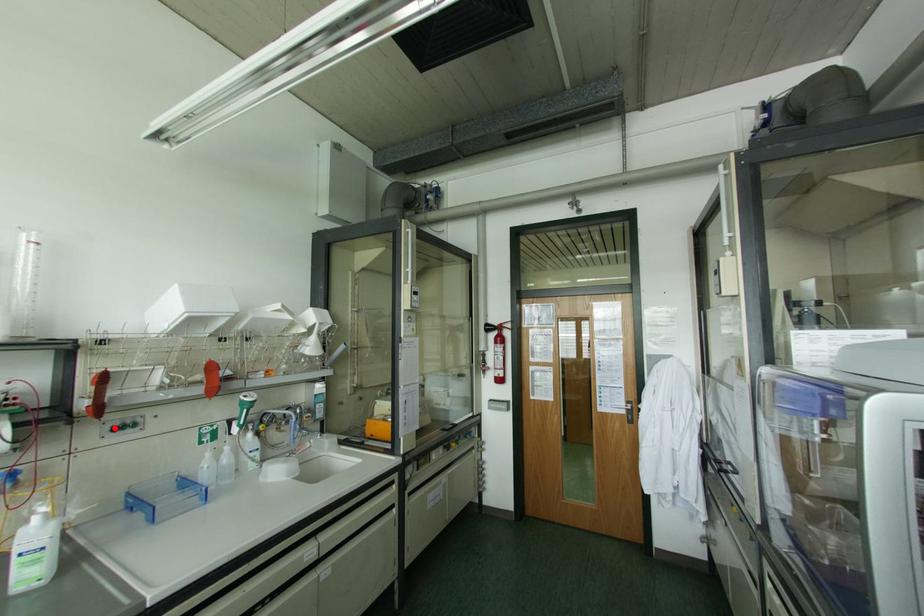
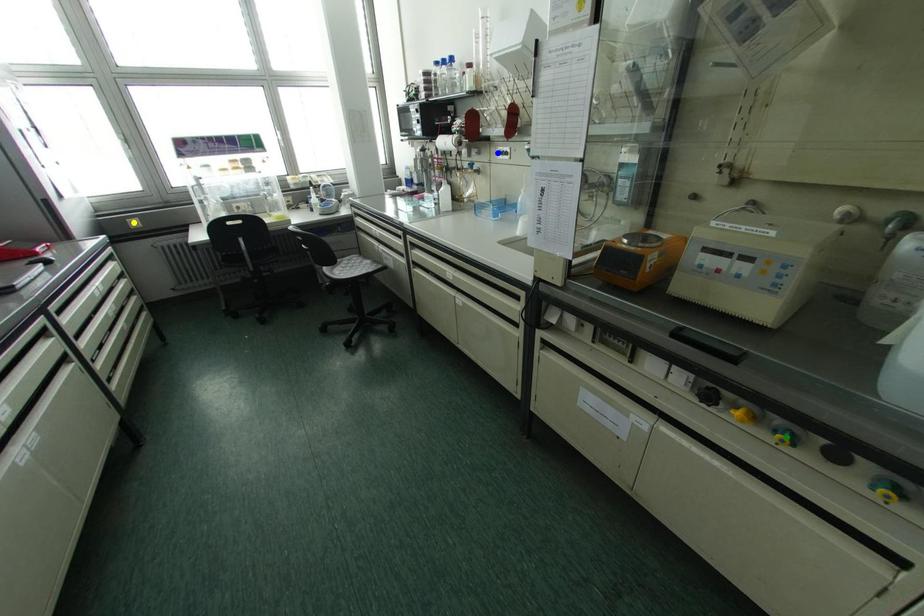
Question: I am providing you with two images of the same scene from different viewpoints. A red point is marked on the first image. You are given multiple points on the second image. Which point in image 2 is actually the same real-world point as the red point in image 1?

Choices:
 (A) green point
 (B) yellow point
 (C) blue point

Answer: (C)